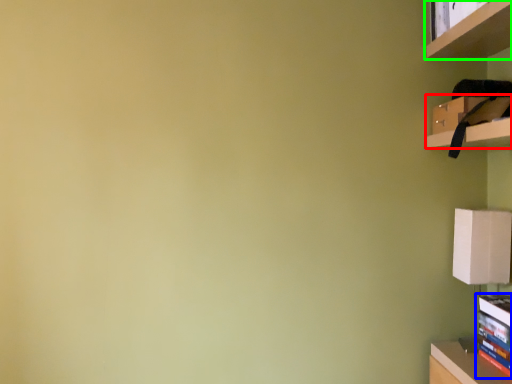
Question: Which is nearer to the cabinet (highlighted by a red box)? book (highlighted by a blue box) or shelf (highlighted by a green box).

Choices:
 (A) book
 (B) shelf

Answer: (B)